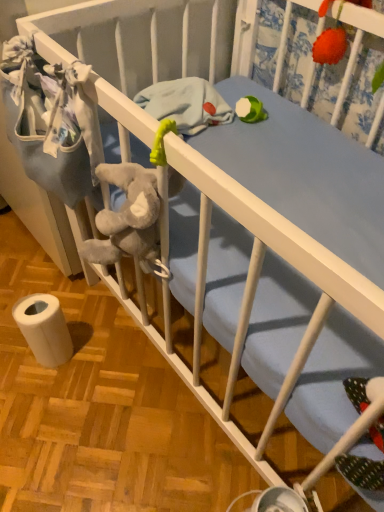
What are the coordinates of `free point in front of white matte toilet paper at lower left` in the screenshot? It's located at (48, 411).